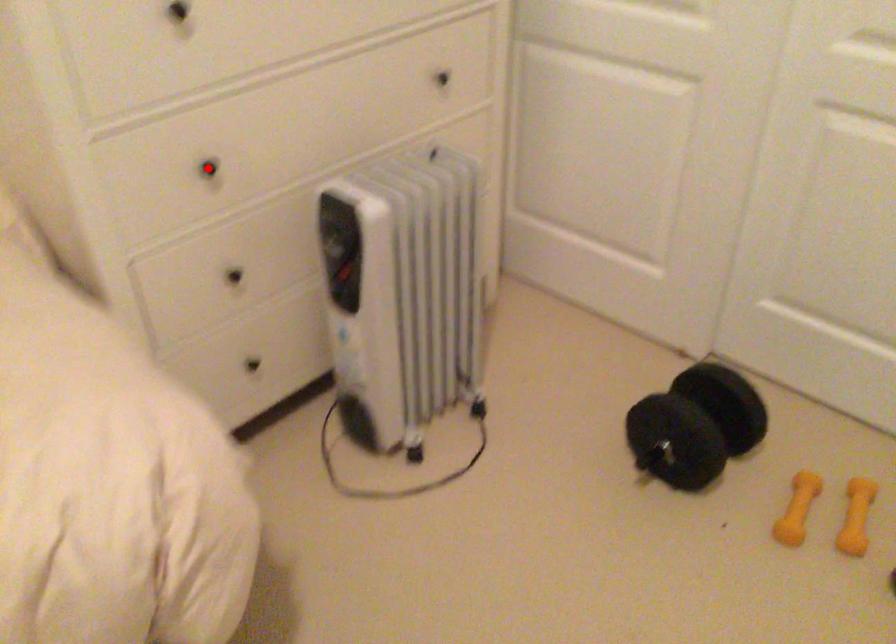
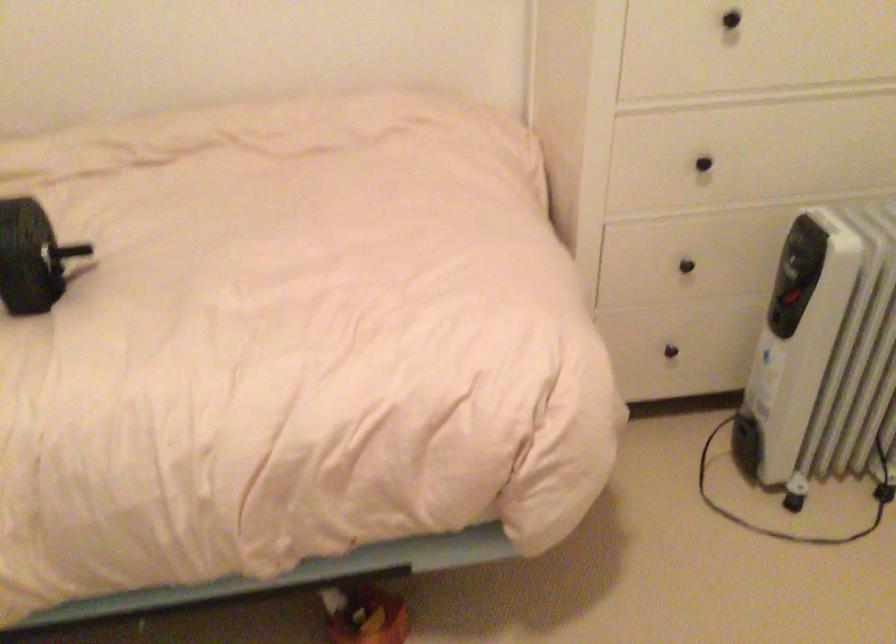
The point at the highlighted location is marked in the first image. Where is the corresponding point in the second image?

(702, 164)